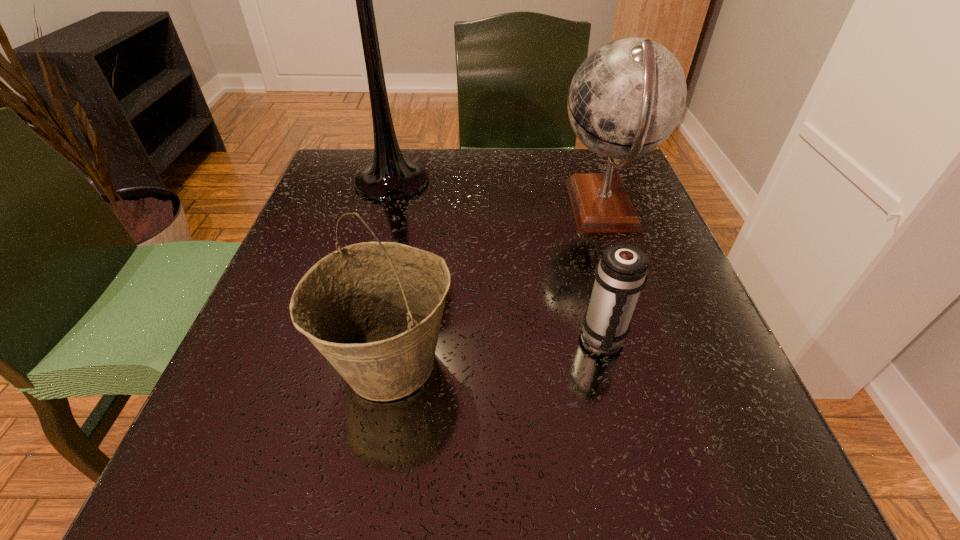
Locate an element on the screen. free region at the left edge of the desktop is located at coordinates (259, 352).

In the image, there is a desktop. Identify the location of vacant area at the right edge. The image size is (960, 540). (637, 209).

This screenshot has width=960, height=540. Identify the location of free location at the far left corner. (348, 193).

Where is `vacant area at the near left corner of the desktop`? This screenshot has height=540, width=960. vacant area at the near left corner of the desktop is located at coordinates (286, 468).

This screenshot has height=540, width=960. In order to click on vacant position at the near right corner of the desktop in this screenshot , I will do `click(669, 468)`.

Image resolution: width=960 pixels, height=540 pixels. What are the coordinates of `unoccupied area between the thermos bottle and the table lamp` in the screenshot? It's located at (498, 259).

You are a GUI agent. You are given a task and a screenshot of the screen. Output one action in this format:
    pyautogui.click(x=<x>, y=<y>)
    Task: Click on the empty space that is in between the tallest object and the shortest object
    Image resolution: width=960 pixels, height=540 pixels.
    Given the screenshot: What is the action you would take?
    pyautogui.click(x=498, y=259)

Find the location of `unoccupied area between the second tallest object and the tallest object`. unoccupied area between the second tallest object and the tallest object is located at coordinates (497, 194).

This screenshot has width=960, height=540. What are the coordinates of `free spot between the second tallest object and the tallest object` in the screenshot? It's located at pos(497,194).

The image size is (960, 540). I want to click on free point between the shortest object and the table lamp, so click(x=498, y=259).